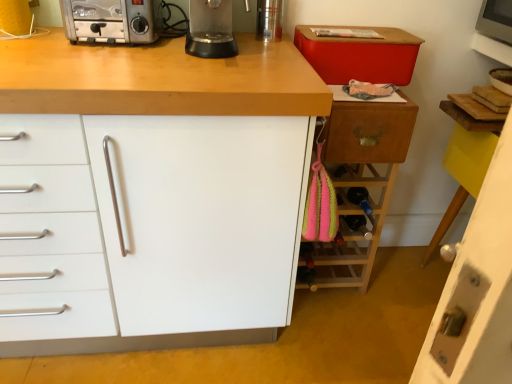
Question: Should I look upward or downward to see silver metallic toaster at upper left?

Choices:
 (A) up
 (B) down

Answer: (A)

Question: Is white matte cabinet at center, arranged as the 1th cabinetry when viewed from the left, far from white glossy door at lower right, the 1th cabinetry in the right-to-left sequence?

Choices:
 (A) no
 (B) yes

Answer: (A)

Question: Is white matte cabinet at center, the 3th cabinetry in the right-to-left sequence, oriented towards white glossy door at lower right, the third cabinetry in the left-to-right sequence?

Choices:
 (A) no
 (B) yes

Answer: (A)

Question: Is white matte cabinet at center, arranged as the 1th cabinetry when viewed from the left, touching white glossy door at lower right, the third cabinetry in the left-to-right sequence?

Choices:
 (A) no
 (B) yes

Answer: (A)

Question: Considering the relative sizes of white matte cabinet at center, the 3th cabinetry in the right-to-left sequence, and white glossy door at lower right, the third cabinetry in the left-to-right sequence, in the image provided, is white matte cabinet at center, the 3th cabinetry in the right-to-left sequence, wider than white glossy door at lower right, the third cabinetry in the left-to-right sequence,?

Choices:
 (A) yes
 (B) no

Answer: (A)

Question: From a real-world perspective, is white matte cabinet at center, the 3th cabinetry in the right-to-left sequence, on top of white glossy door at lower right, the 1th cabinetry in the right-to-left sequence?

Choices:
 (A) yes
 (B) no

Answer: (A)

Question: Is white matte cabinet at center, the 3th cabinetry in the right-to-left sequence, oriented away from white glossy door at lower right, the third cabinetry in the left-to-right sequence?

Choices:
 (A) yes
 (B) no

Answer: (B)

Question: Is wooden drawer at right at the back of silver metallic toaster at upper left?

Choices:
 (A) no
 (B) yes

Answer: (A)

Question: Considering the relative positions of silver metallic toaster at upper left and wooden drawer at right in the image provided, is silver metallic toaster at upper left to the right of wooden drawer at right from the viewer's perspective?

Choices:
 (A) yes
 (B) no

Answer: (B)

Question: Considering the relative sizes of silver metallic toaster at upper left and wooden drawer at right in the image provided, is silver metallic toaster at upper left shorter than wooden drawer at right?

Choices:
 (A) no
 (B) yes

Answer: (B)

Question: Is silver metallic toaster at upper left positioned behind wooden drawer at right?

Choices:
 (A) yes
 (B) no

Answer: (B)

Question: Considering the relative positions of silver metallic toaster at upper left and wooden drawer at right in the image provided, is silver metallic toaster at upper left to the left of wooden drawer at right from the viewer's perspective?

Choices:
 (A) no
 (B) yes

Answer: (B)

Question: Does silver metallic toaster at upper left have a lesser width compared to wooden drawer at right?

Choices:
 (A) no
 (B) yes

Answer: (A)

Question: Is white matte cabinet at center, arranged as the 1th cabinetry when viewed from the left, at the back of wooden wine rack at right, arranged as the 2th cabinetry when viewed from the left?

Choices:
 (A) yes
 (B) no

Answer: (B)